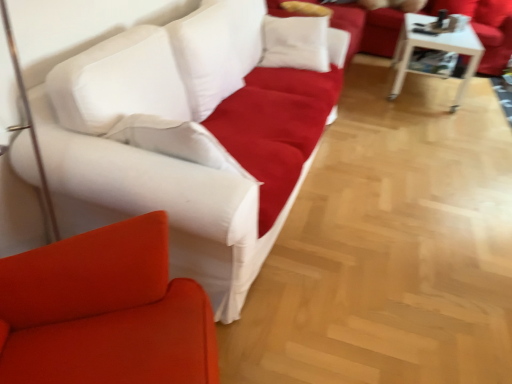
In order to face white fabric couch at center, which is the first studio couch from front to back, should I rotate leftwards or rightwards?

To align with it, rotate left about 2.229°.

The height and width of the screenshot is (384, 512). What do you see at coordinates (192, 135) in the screenshot?
I see `white fabric couch at center, which is the second studio couch in right-to-left order` at bounding box center [192, 135].

Describe the element at coordinates (436, 49) in the screenshot. This screenshot has height=384, width=512. I see `white glossy table at upper right` at that location.

This screenshot has width=512, height=384. Find the location of `matte white studio couch at upper center, the 2th studio couch from the left`. matte white studio couch at upper center, the 2th studio couch from the left is located at coordinates (485, 29).

Is matte white studio couch at upper center, which is the first studio couch from top to bottom, smaller than white fabric couch at center, the 1th studio couch viewed from the left?

Yes, matte white studio couch at upper center, which is the first studio couch from top to bottom, is smaller than white fabric couch at center, the 1th studio couch viewed from the left.

The height and width of the screenshot is (384, 512). Find the location of `studio couch that appears above the matte white studio couch at upper center, the 2th studio couch from the left (from a real-world perspective)`. studio couch that appears above the matte white studio couch at upper center, the 2th studio couch from the left (from a real-world perspective) is located at coordinates (192, 135).

Is matte white studio couch at upper center, which is the 2th studio couch in bottom-to-top order, at the left side of white fabric couch at center, the 1th studio couch viewed from the left?

In fact, matte white studio couch at upper center, which is the 2th studio couch in bottom-to-top order, is to the right of white fabric couch at center, the 1th studio couch viewed from the left.

From the image's perspective, is white fabric couch at center, which is counted as the 2th studio couch, starting from the back, located beneath matte white studio couch at upper center, which is the first studio couch from top to bottom?

Correct, white fabric couch at center, which is counted as the 2th studio couch, starting from the back, appears lower than matte white studio couch at upper center, which is the first studio couch from top to bottom, in the image.

Which of these two, white fabric couch at center, the 1th studio couch viewed from the left, or matte white studio couch at upper center, arranged as the 2th studio couch when viewed from the front, stands shorter?

With less height is matte white studio couch at upper center, arranged as the 2th studio couch when viewed from the front.

Does white fabric couch at center, which is counted as the 2th studio couch, starting from the back, appear on the left side of matte white studio couch at upper center, arranged as the 2th studio couch when viewed from the front?

Indeed, white fabric couch at center, which is counted as the 2th studio couch, starting from the back, is positioned on the left side of matte white studio couch at upper center, arranged as the 2th studio couch when viewed from the front.

Is matte white studio couch at upper center, the 2th studio couch from the left, located within white fabric couch at center, which is the second studio couch in right-to-left order?

Actually, matte white studio couch at upper center, the 2th studio couch from the left, is outside white fabric couch at center, which is the second studio couch in right-to-left order.

In the scene shown: From a real-world perspective, between matte white studio couch at upper center, arranged as the 2th studio couch when viewed from the front, and white glossy table at upper right, who is vertically higher?

matte white studio couch at upper center, arranged as the 2th studio couch when viewed from the front, from a real-world perspective.

Which is farther, (x=366, y=45) or (x=398, y=47)?

The point (x=366, y=45) is more distant.

Is matte white studio couch at upper center, arranged as the 1th studio couch when viewed from the right, oriented towards white glossy table at upper right?

No, matte white studio couch at upper center, arranged as the 1th studio couch when viewed from the right, is not aimed at white glossy table at upper right.

Which object is wider, matte white studio couch at upper center, arranged as the 2th studio couch when viewed from the front, or white glossy table at upper right?

Wider between the two is matte white studio couch at upper center, arranged as the 2th studio couch when viewed from the front.

Measure the distance between white glossy table at upper right and matte white studio couch at upper center, arranged as the 2th studio couch when viewed from the front.

They are 22.93 inches apart.

From a real-world perspective, is white glossy table at upper right over matte white studio couch at upper center, positioned as the 1th studio couch in back-to-front order?

Actually, white glossy table at upper right is physically below matte white studio couch at upper center, positioned as the 1th studio couch in back-to-front order, in the real world.

Is matte white studio couch at upper center, positioned as the 1th studio couch in back-to-front order, inside white glossy table at upper right?

Actually, matte white studio couch at upper center, positioned as the 1th studio couch in back-to-front order, is outside white glossy table at upper right.

Are white glossy table at upper right and white fabric couch at center, which is the second studio couch in right-to-left order, far apart?

Yes, white glossy table at upper right and white fabric couch at center, which is the second studio couch in right-to-left order, are quite far apart.

From the image's perspective, between white glossy table at upper right and white fabric couch at center, which is the first studio couch from front to back, who is located below?

From the image's view, white fabric couch at center, which is the first studio couch from front to back, is below.

Which point is more forward, (x=401, y=84) or (x=100, y=85)?

The point (x=100, y=85) is closer to the camera.

Which is correct: white glossy table at upper right is inside white fabric couch at center, the second studio couch in the top-to-bottom sequence, or outside of it?

white glossy table at upper right cannot be found inside white fabric couch at center, the second studio couch in the top-to-bottom sequence.

Looking at this image, which of these two, white fabric couch at center, the 1th studio couch viewed from the left, or white glossy table at upper right, is bigger?

With larger size is white fabric couch at center, the 1th studio couch viewed from the left.

Does white fabric couch at center, which is the second studio couch in right-to-left order, lie in front of white glossy table at upper right?

Yes.

What's the angular difference between white fabric couch at center, which is the first studio couch from front to back, and white glossy table at upper right's facing directions?

The angle between the facing direction of white fabric couch at center, which is the first studio couch from front to back, and the facing direction of white glossy table at upper right is 87.7 degrees.

From the image's perspective, is white fabric couch at center, the 1th studio couch viewed from the left, on white glossy table at upper right?

No, from the image's perspective, white fabric couch at center, the 1th studio couch viewed from the left, is not above white glossy table at upper right.

The height and width of the screenshot is (384, 512). Identify the location of studio couch in front of the matte white studio couch at upper center, the 2th studio couch from the left. (192, 135).

Where is `studio couch above the white fabric couch at center, the 1th studio couch viewed from the left (from the image's perspective)`? This screenshot has width=512, height=384. studio couch above the white fabric couch at center, the 1th studio couch viewed from the left (from the image's perspective) is located at coordinates (485, 29).

When comparing their distances from white fabric couch at center, arranged as the first studio couch when ordered from the bottom, does matte white studio couch at upper center, arranged as the 2th studio couch when viewed from the front, or white glossy table at upper right seem closer?

Among the two, white glossy table at upper right is located nearer to white fabric couch at center, arranged as the first studio couch when ordered from the bottom.

Which object lies nearer to the anchor point matte white studio couch at upper center, which is the first studio couch from top to bottom, white fabric couch at center, the second studio couch in the top-to-bottom sequence, or white glossy table at upper right?

white glossy table at upper right.

When comparing their distances from matte white studio couch at upper center, which is the 2th studio couch in bottom-to-top order, does white glossy table at upper right or white fabric couch at center, arranged as the first studio couch when ordered from the bottom, seem closer?

white glossy table at upper right is positioned closer to the anchor matte white studio couch at upper center, which is the 2th studio couch in bottom-to-top order.

Considering their positions, is white fabric couch at center, which is counted as the 2th studio couch, starting from the back, positioned closer to white glossy table at upper right than matte white studio couch at upper center, which is the first studio couch from top to bottom?

Based on the image, matte white studio couch at upper center, which is the first studio couch from top to bottom, appears to be nearer to white glossy table at upper right.

When comparing their distances from white fabric couch at center, the 1th studio couch viewed from the left, does white glossy table at upper right or matte white studio couch at upper center, arranged as the 1th studio couch when viewed from the right, seem closer?

white glossy table at upper right.

From the image, which object appears to be farther from white glossy table at upper right, matte white studio couch at upper center, arranged as the 1th studio couch when viewed from the right, or white fabric couch at center, the second studio couch in the top-to-bottom sequence?

Based on the image, white fabric couch at center, the second studio couch in the top-to-bottom sequence, appears to be further to white glossy table at upper right.

What are the coordinates of `table between white fabric couch at center, which is the first studio couch from front to back, and matte white studio couch at upper center, arranged as the 1th studio couch when viewed from the right, along the z-axis` in the screenshot? It's located at (436, 49).